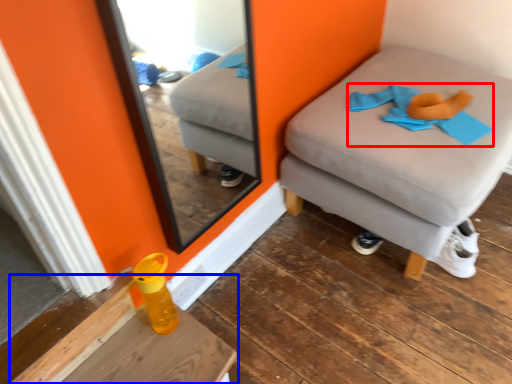
Question: Among these objects, which one is farthest to the camera, clothe (highlighted by a red box) or table (highlighted by a blue box)?

Choices:
 (A) clothe
 (B) table

Answer: (A)